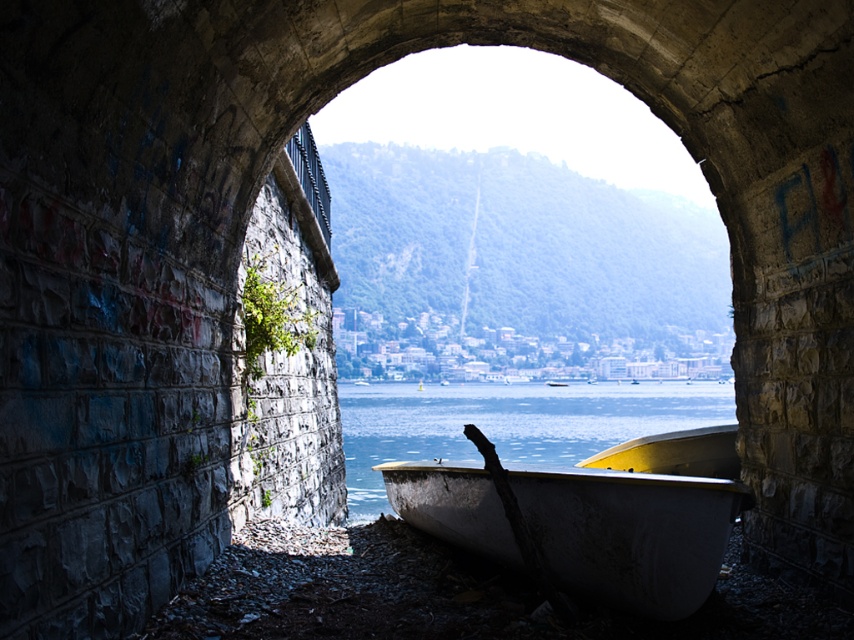
You are planning to place a 3 meter long wooden bench on the rocky ground next to the white weathered canoe at lower right. Can the bench fit next to the canoe without overlapping the clear water at boat right?

The white weathered canoe at lower right is narrower than the clear water at boat right. Since the bench is 3 meters long, it can be placed next to the canoe as long as it stays within the rocky ground area and does not extend into the water.

You are standing at the center of the stone archway and want to walk towards the two points marked in the image. Which point, point (677, 515) or point (361, 448), will you reach first?

You will reach point (677, 515) first because it is closer to you than point (361, 448).